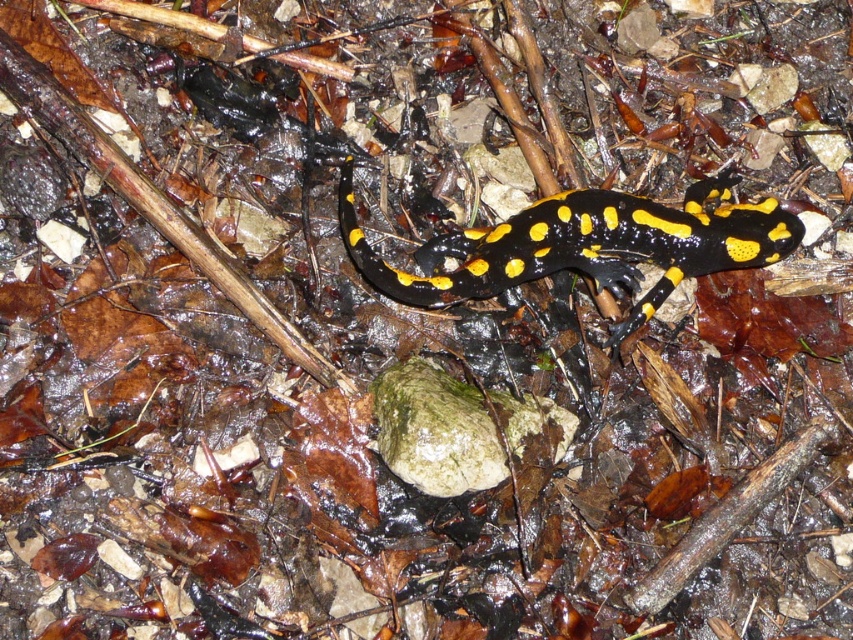
Is yellow-black spotted salamander at center shorter than green mossy rock at center?

No.

Does yellow-black spotted salamander at center appear on the left side of green mossy rock at center?

No, yellow-black spotted salamander at center is not to the left of green mossy rock at center.

This screenshot has height=640, width=853. What are the coordinates of `yellow-black spotted salamander at center` in the screenshot? It's located at (585, 244).